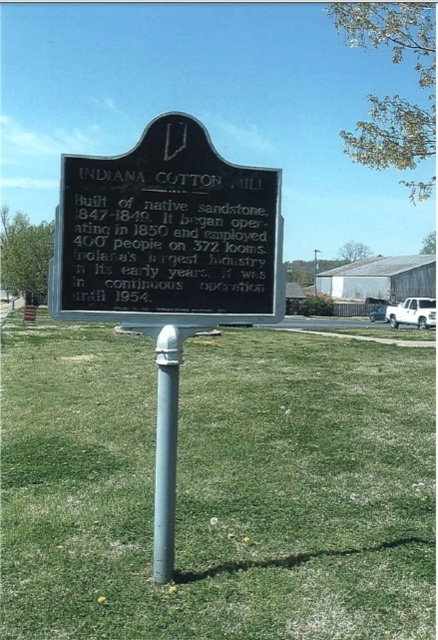
Question: Which object is positioned closest to the black sandstone sign at center?

Choices:
 (A) blackmaterial/texturetext at center
 (B) silver metallic pole at center
 (C) green grass at center

Answer: (A)

Question: Which of the following is the closest to the observer?

Choices:
 (A) silver metallic pole at center
 (B) blackmaterial/texturetext at center

Answer: (A)

Question: Which object is farther from the camera taking this photo?

Choices:
 (A) blackmaterial/texturetext at center
 (B) green grass at center

Answer: (A)

Question: Is green grass at center above blackmaterial/texturetext at center?

Choices:
 (A) no
 (B) yes

Answer: (A)

Question: Can you confirm if black sandstone sign at center is wider than blackmaterial/texturetext at center?

Choices:
 (A) no
 (B) yes

Answer: (B)

Question: Is black sandstone sign at center positioned behind blackmaterial/texturetext at center?

Choices:
 (A) no
 (B) yes

Answer: (A)